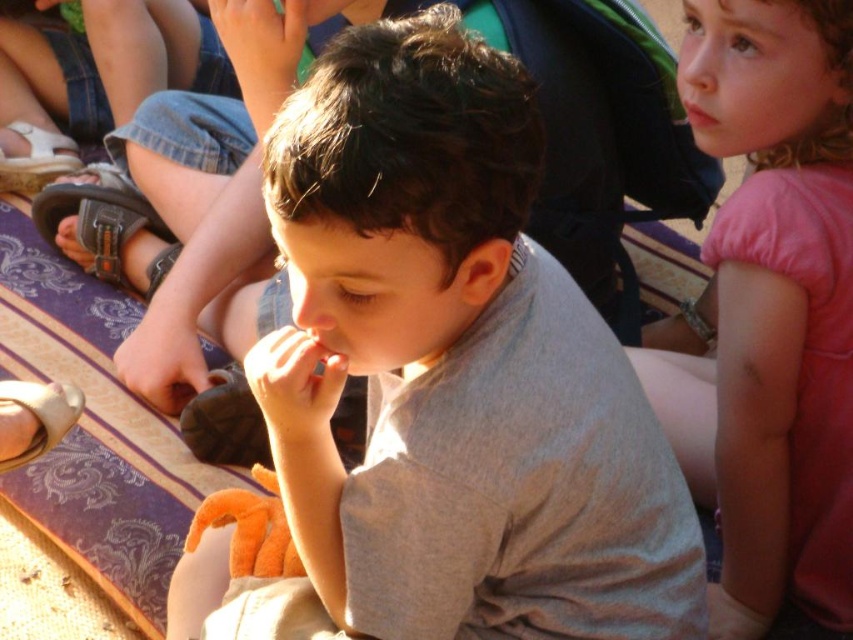
Question: Which of these objects is positioned farthest from the leather sandal at lower left?

Choices:
 (A) pink cotton shirt at upper right
 (B) brown leather sandal at lower left
 (C) gray cotton shirt at center

Answer: (A)

Question: Can you confirm if pink cotton shirt at upper right is bigger than brown leather sandal at lower left?

Choices:
 (A) yes
 (B) no

Answer: (A)

Question: Which object appears farthest from the camera in this image?

Choices:
 (A) brown leather sandal at lower left
 (B) gray cotton shirt at center

Answer: (A)

Question: Is gray cotton shirt at center to the right of pink cotton shirt at upper right from the viewer's perspective?

Choices:
 (A) yes
 (B) no

Answer: (B)

Question: Which point appears farthest from the camera in this image?

Choices:
 (A) (354, 288)
 (B) (33, 156)
 (C) (753, 339)

Answer: (B)

Question: Is pink cotton shirt at upper right to the right of brown leather sandal at lower left from the viewer's perspective?

Choices:
 (A) no
 (B) yes

Answer: (B)